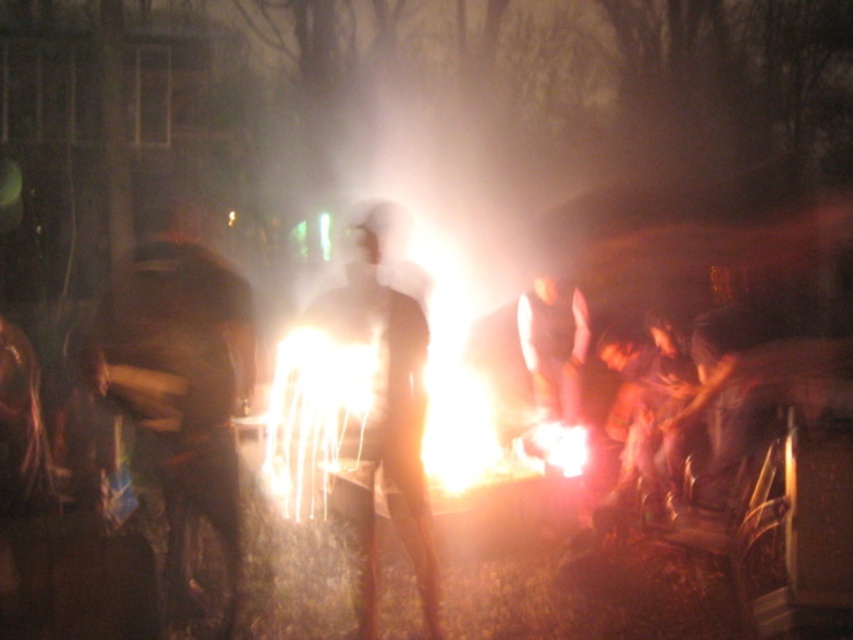
Question: Which point is closer to the camera?

Choices:
 (A) (410, 396)
 (B) (177, 356)

Answer: (B)

Question: Is dark brown leather jacket at left to the left of translucent white figure at center from the viewer's perspective?

Choices:
 (A) yes
 (B) no

Answer: (A)

Question: Which of the following is the farthest from the observer?

Choices:
 (A) (146, 401)
 (B) (387, 296)

Answer: (B)

Question: Which of the following is the farthest from the observer?

Choices:
 (A) click(x=155, y=342)
 (B) click(x=367, y=280)

Answer: (B)

Question: Can you confirm if dark brown leather jacket at left is positioned to the left of translucent white figure at center?

Choices:
 (A) no
 (B) yes

Answer: (B)

Question: Does dark brown leather jacket at left appear on the right side of translucent white figure at center?

Choices:
 (A) yes
 (B) no

Answer: (B)